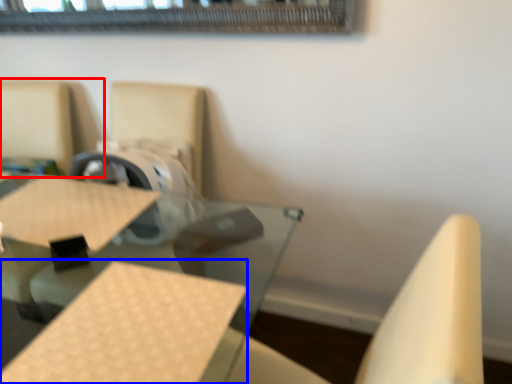
Question: Which of the following is the closest to the observer, chair (highlighted by a red box) or plywood (highlighted by a blue box)?

Choices:
 (A) chair
 (B) plywood

Answer: (B)